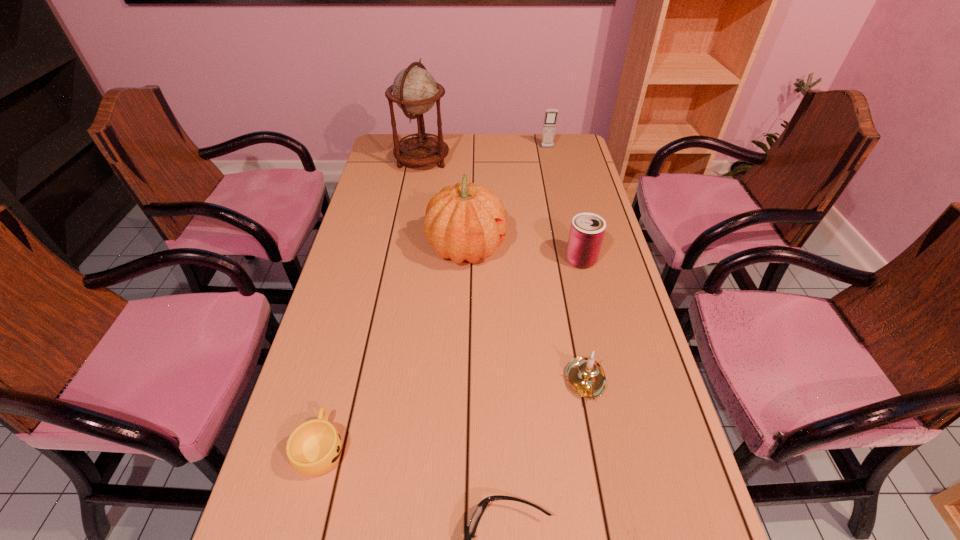
Locate an element on the screen. The height and width of the screenshot is (540, 960). object that stands as the closest to the globe is located at coordinates (462, 222).